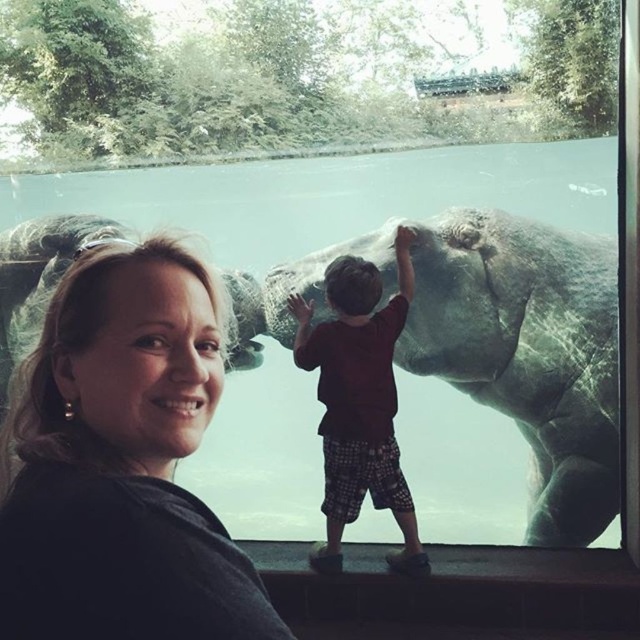
Measure the distance between matte black hair at upper left and gray matte elephant at center.

matte black hair at upper left is 9.98 feet away from gray matte elephant at center.

Is matte black hair at upper left below gray matte elephant at center?

Yes, matte black hair at upper left is below gray matte elephant at center.

This screenshot has width=640, height=640. Identify the location of matte black hair at upper left. (120, 461).

At what (x,y) coordinates should I click in order to perform the action: click on matte black hair at upper left. Please return your answer as a coordinate pair (x, y). This screenshot has width=640, height=640. Looking at the image, I should click on (120, 461).

Does gray matte elephant at center lie behind brown cotton shirt at center?

Yes.

Can you confirm if gray matte elephant at center is bigger than brown cotton shirt at center?

Correct, gray matte elephant at center is larger in size than brown cotton shirt at center.

This screenshot has width=640, height=640. What do you see at coordinates (528, 353) in the screenshot? I see `gray matte elephant at center` at bounding box center [528, 353].

The image size is (640, 640). I want to click on gray matte elephant at center, so click(528, 353).

Can you confirm if matte black hair at upper left is positioned above brown cotton shirt at center?

Correct, matte black hair at upper left is located above brown cotton shirt at center.

Between matte black hair at upper left and brown cotton shirt at center, which one is positioned lower?

brown cotton shirt at center

Is point (74, 442) positioned behind point (349, 410)?

No, it is in front of (349, 410).

This screenshot has height=640, width=640. In order to click on matte black hair at upper left in this screenshot , I will do `click(120, 461)`.